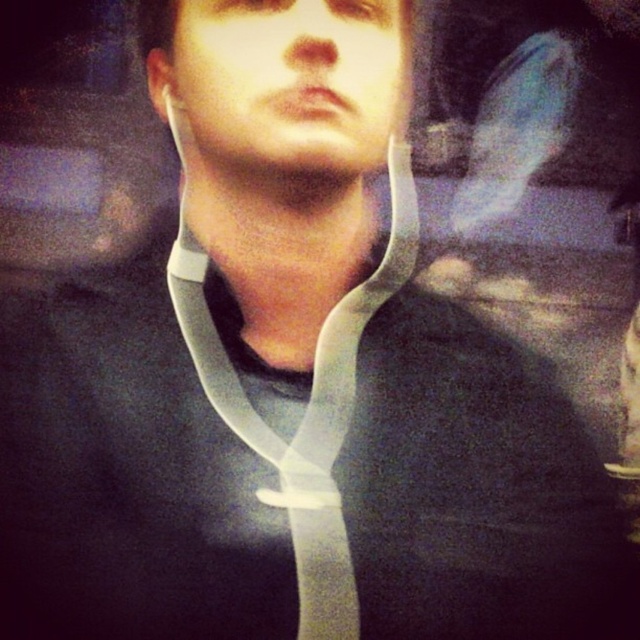
Is matte plastic neck brace at center thinner than clear plastic neckband at center?

Correct, matte plastic neck brace at center's width is less than clear plastic neckband at center's.

Is point (304, 177) in front of point (214, 339)?

Yes.

At what (x,y) coordinates should I click in order to perform the action: click on matte plastic neck brace at center. Please return your answer as a coordinate pair (x, y). This screenshot has height=640, width=640. Looking at the image, I should click on (289, 83).

Locate an element on the screen. The width and height of the screenshot is (640, 640). matte plastic neck brace at center is located at coordinates (289, 83).